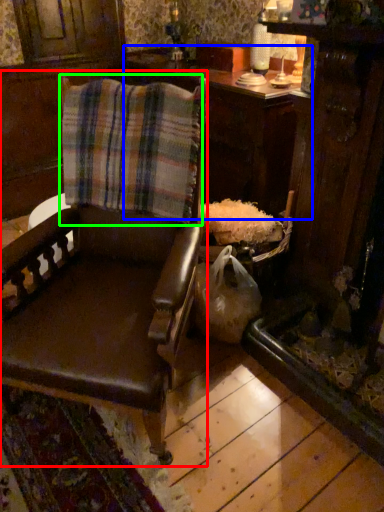
Question: Based on their relative distances, which object is farther from chair (highlighted by a red box)? Choose from table (highlighted by a blue box) and flannel (highlighted by a green box).

Choices:
 (A) table
 (B) flannel

Answer: (A)